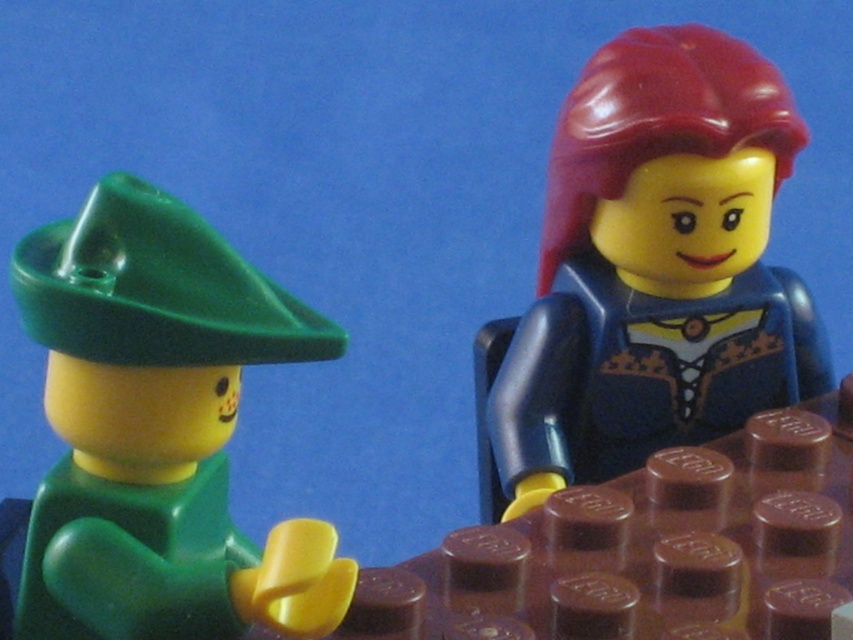
You are a LEGO collector examining the two minifigures. Which object is positioned higher in the image, the shiny red hair at upper right or the green matte hat at left?

The shiny red hair at upper right is located above the green matte hat at left, so it is positioned higher in the image.

You are a photographer trying to capture the shiny red hair at upper right in focus. The camera can only focus on objects within a 0.1 unit radius around the point specified. Is the point at coordinates point (650, 273) within 0.1 units of the shiny red hair at upper right?

Yes, the point (650, 273) is exactly where the shiny red hair at upper right is located, so it will be in focus.